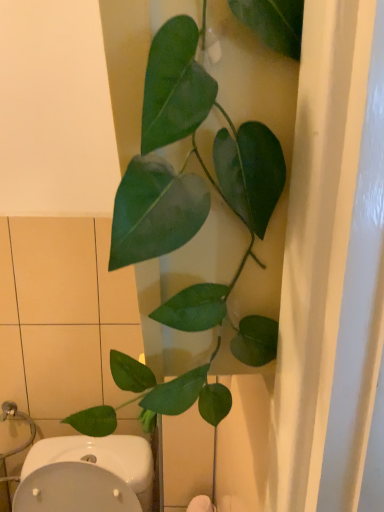
Locate an element on the screen. green matte leafy plant at center is located at coordinates (190, 175).

The width and height of the screenshot is (384, 512). What do you see at coordinates (190, 175) in the screenshot?
I see `green matte leafy plant at center` at bounding box center [190, 175].

Where is `green matte leafy plant at center`? The width and height of the screenshot is (384, 512). green matte leafy plant at center is located at coordinates (190, 175).